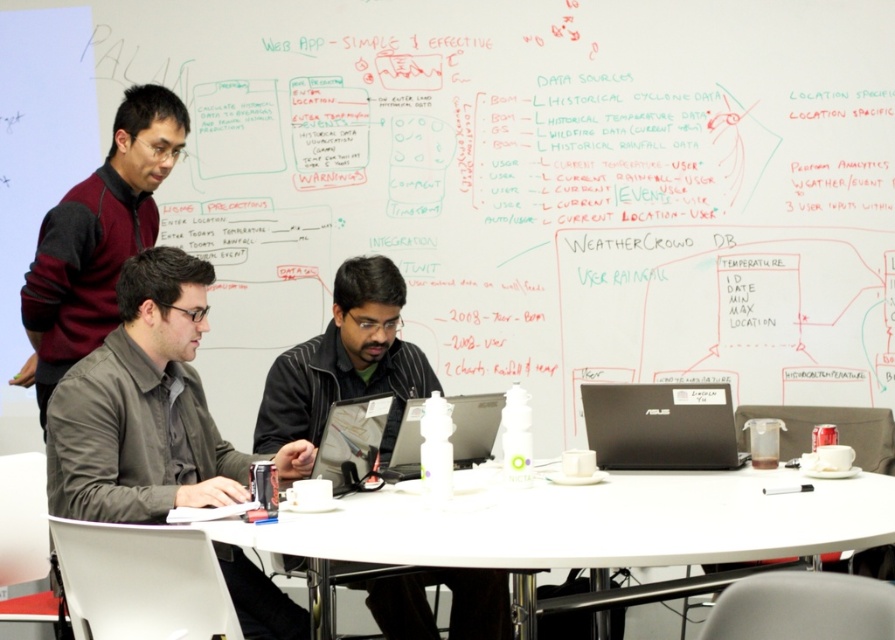
What is the position of the point with coordinates (346, 362) in the image?

The point with coordinates (346, 362) is located on the black matte shirt at center.

You are a new team member joining the meeting and need to locate the laptop of the person sitting at the center. Based on the scene described, where would you find the matte black laptop at center relative to the black matte shirt at center?

The matte black laptop at center is located behind the black matte shirt at center, so you would find it positioned behind the individual wearing the black matte shirt at center.

You are a delivery person who needs to place a large box on the table. The box is as wide as the black matte laptop at center. Can you fit the box on the white plastic table at center without overlapping the edges?

The white plastic table at center is wider than the black matte laptop at center, so the box, which is as wide as the laptop, will fit on the table without overlapping the edges.